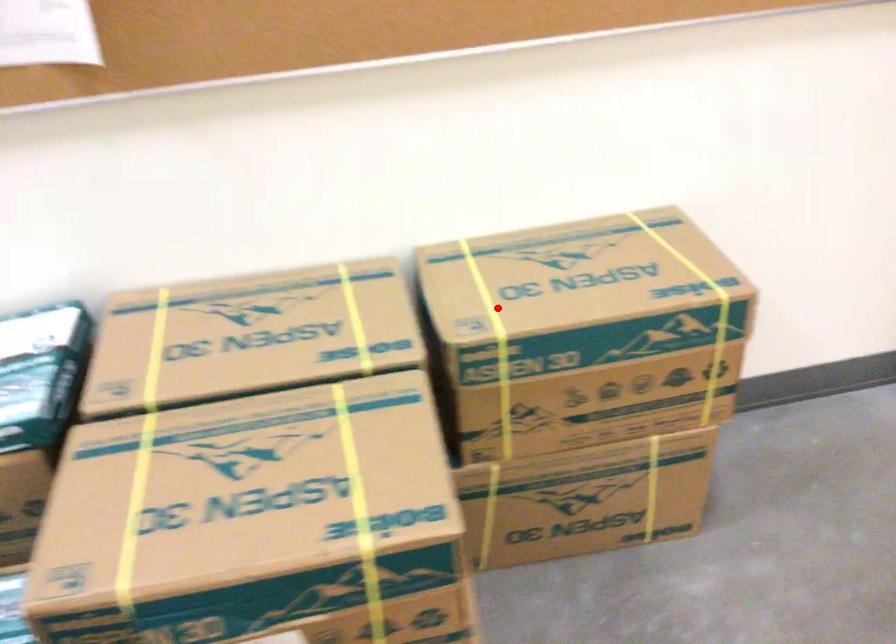
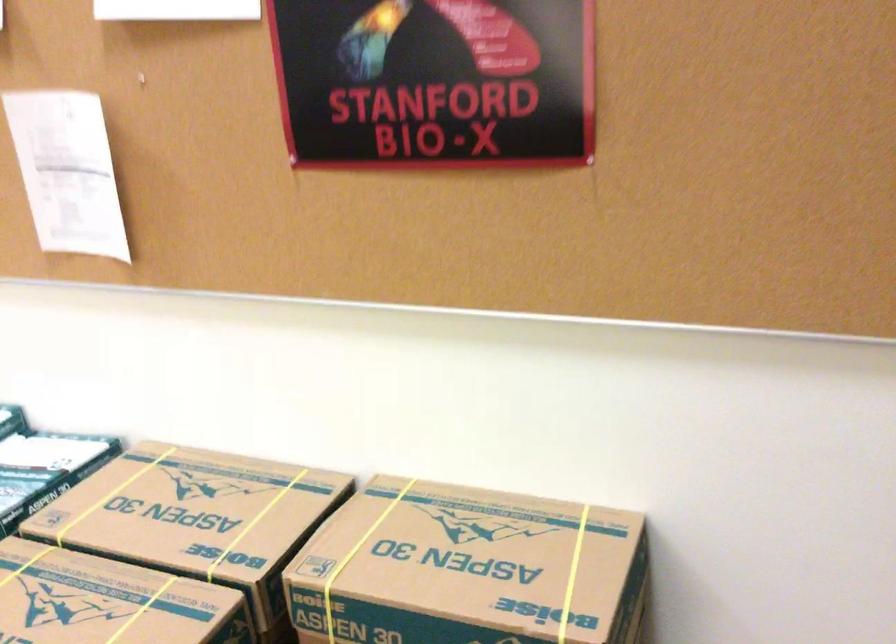
In the second image, find the point that corresponds to the highlighted location in the first image.

(357, 556)